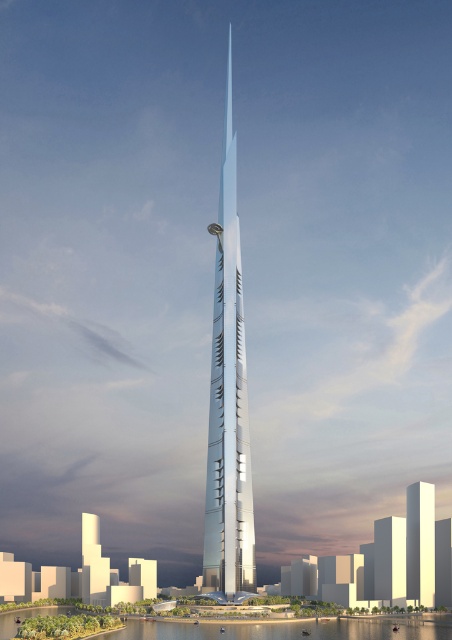
Between shiny glass skyscraper at center and clear water at lower center, which one appears on the right side from the viewer's perspective?

From the viewer's perspective, shiny glass skyscraper at center appears more on the right side.

Between point (252, 545) and point (133, 634), which one is positioned behind?

Point (252, 545)

You are a GUI agent. You are given a task and a screenshot of the screen. Output one action in this format:
    pyautogui.click(x=<x>, y=<y>)
    Task: Click on the shiny glass skyscraper at center
    Image resolution: width=452 pixels, height=640 pixels.
    Given the screenshot: What is the action you would take?
    pyautogui.click(x=227, y=400)

Who is more forward, (238, 513) or (415, 532)?

Point (238, 513)

Between point (208, 508) and point (432, 538), which one is positioned behind?

The point (432, 538) is behind.

Describe the element at coordinates (227, 400) in the screenshot. I see `shiny glass skyscraper at center` at that location.

At what (x,y) coordinates should I click in order to perform the action: click on shiny glass skyscraper at center. Please return your answer as a coordinate pair (x, y). Looking at the image, I should click on (227, 400).

Who is positioned more to the right, clear water at lower center or shiny silver tower at center?

shiny silver tower at center is more to the right.

Is clear water at lower center to the left of shiny silver tower at center from the viewer's perspective?

Correct, you'll find clear water at lower center to the left of shiny silver tower at center.

Between point (273, 634) and point (433, 484), which one is positioned behind?

Positioned behind is point (433, 484).

The height and width of the screenshot is (640, 452). Identify the location of clear water at lower center. (281, 630).